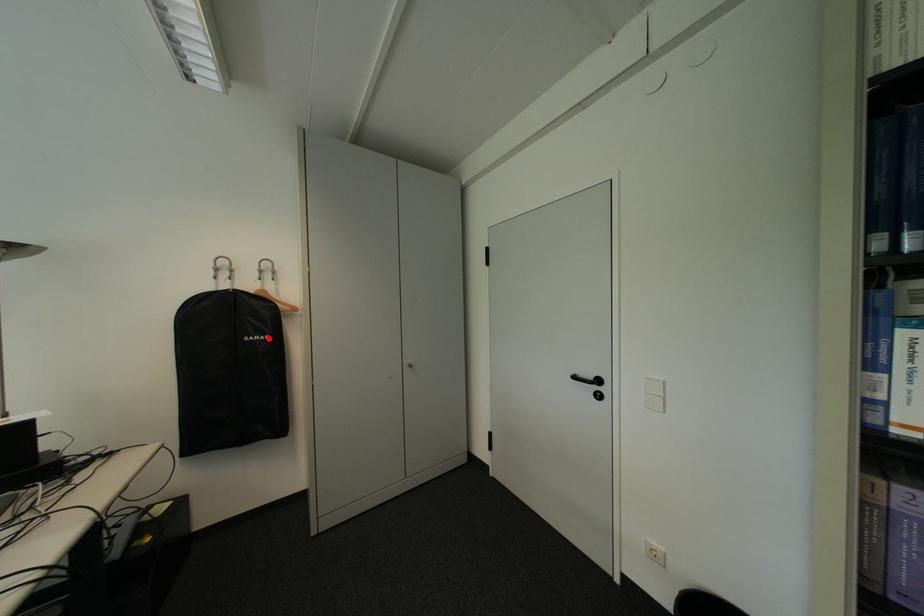
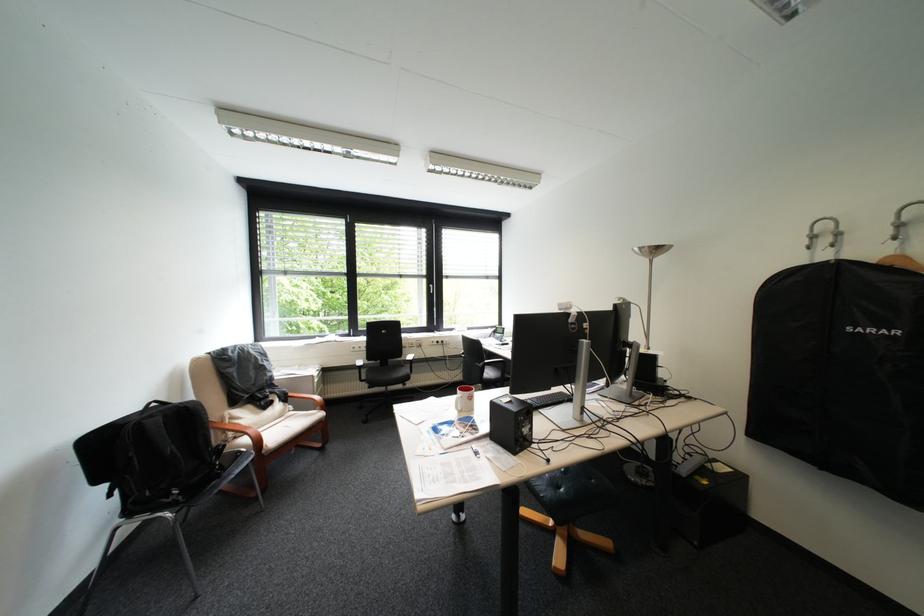
Question: A red point is marked in image1. In image2, is the corresponding 3D point closer to the camera or farther? Reply with the corresponding letter.

Choices:
 (A) The corresponding 3D point is closer.
 (B) The corresponding 3D point is farther.

Answer: (A)